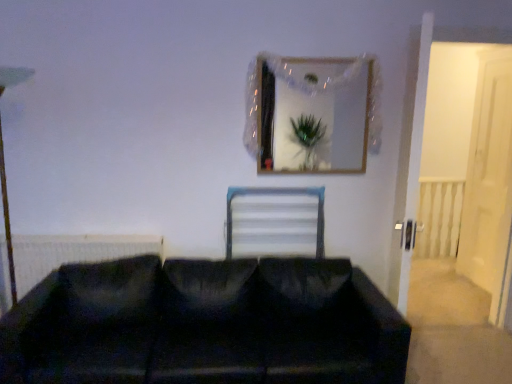
Question: Considering the positions of white plastic radiator at center and white glossy door at right in the image, is white plastic radiator at center taller or shorter than white glossy door at right?

Choices:
 (A) short
 (B) tall

Answer: (A)

Question: Looking at the image, does white plastic radiator at center seem bigger or smaller compared to white glossy door at right?

Choices:
 (A) small
 (B) big

Answer: (A)

Question: Which object is positioned closest to the black matte radiator at left?

Choices:
 (A) black fabric studio couch at lower center
 (B) white glossy door at right
 (C) white plastic radiator at center
 (D) wooden frame at upper center

Answer: (A)

Question: Estimate the real-world distances between objects in this image. Which object is closer to the wooden frame at upper center?

Choices:
 (A) black matte radiator at left
 (B) black fabric studio couch at lower center
 (C) white plastic radiator at center
 (D) white glossy door at right

Answer: (C)